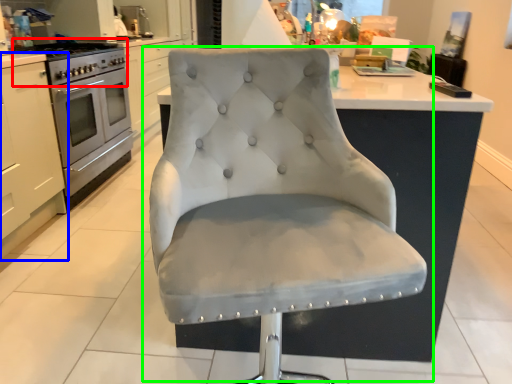
Question: Which object is positioned farthest from gas stove (highlighted by a red box)? Select from cabinetry (highlighted by a blue box) and chair (highlighted by a green box).

Choices:
 (A) cabinetry
 (B) chair

Answer: (B)